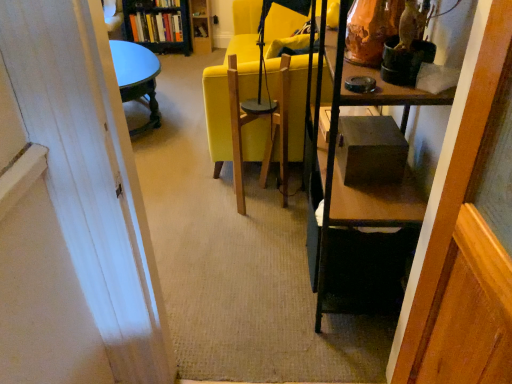
You are a GUI agent. You are given a task and a screenshot of the screen. Output one action in this format:
    pyautogui.click(x=<x>, y=<y>)
    Task: Click on the vacant space underneath wooden swivel chair at center (from a real-world perspective)
    The width and height of the screenshot is (512, 384).
    Given the screenshot: What is the action you would take?
    pyautogui.click(x=264, y=198)